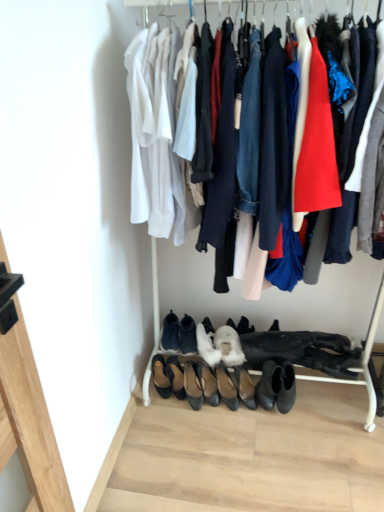
Question: From a real-world perspective, is brown leather shoe at lower left, the first footwear from the left, physically below black leather flats at center, positioned as the 5th footwear in left-to-right order?

Choices:
 (A) no
 (B) yes

Answer: (A)

Question: Is brown leather shoe at lower left, the first footwear from the left, positioned far away from black leather flats at center, positioned as the 5th footwear in left-to-right order?

Choices:
 (A) no
 (B) yes

Answer: (A)

Question: Are brown leather shoe at lower left, which ranks as the ninth footwear in right-to-left order, and black leather flats at center, the 5th footwear in the right-to-left sequence, beside each other?

Choices:
 (A) yes
 (B) no

Answer: (B)

Question: Is brown leather shoe at lower left, the first footwear from the left, wider than black leather flats at center, positioned as the 5th footwear in left-to-right order?

Choices:
 (A) no
 (B) yes

Answer: (A)

Question: Is the position of brown leather shoe at lower left, which ranks as the ninth footwear in right-to-left order, more distant than that of black leather flats at center, the 5th footwear in the right-to-left sequence?

Choices:
 (A) yes
 (B) no

Answer: (A)

Question: From the image's perspective, is white suede heels at center, acting as the sixth footwear starting from the left, above or below white fluffy boot at center, the 7th footwear positioned from the left?

Choices:
 (A) below
 (B) above

Answer: (A)

Question: In the image, is white suede heels at center, arranged as the 4th footwear when viewed from the right, positioned in front of or behind white fluffy boot at center, the third footwear when ordered from right to left?

Choices:
 (A) behind
 (B) front

Answer: (B)

Question: Based on their positions, is white suede heels at center, arranged as the 4th footwear when viewed from the right, located to the left or right of white fluffy boot at center, the 7th footwear positioned from the left?

Choices:
 (A) right
 (B) left

Answer: (B)

Question: From a real-world perspective, is white suede heels at center, arranged as the 4th footwear when viewed from the right, physically located above or below white fluffy boot at center, the 7th footwear positioned from the left?

Choices:
 (A) below
 (B) above

Answer: (A)

Question: From the image's perspective, is black leather shoes at lower center, the 9th footwear in the left-to-right sequence, positioned above or below white suede heels at center, acting as the sixth footwear starting from the left?

Choices:
 (A) below
 (B) above

Answer: (A)

Question: Is black leather shoes at lower center, the first footwear from the right, bigger or smaller than white suede heels at center, acting as the sixth footwear starting from the left?

Choices:
 (A) small
 (B) big

Answer: (A)

Question: Considering their positions, is black leather shoes at lower center, the 9th footwear in the left-to-right sequence, located in front of or behind white suede heels at center, acting as the sixth footwear starting from the left?

Choices:
 (A) behind
 (B) front

Answer: (B)

Question: From a real-world perspective, is black leather shoes at lower center, the 9th footwear in the left-to-right sequence, above or below white suede heels at center, arranged as the 4th footwear when viewed from the right?

Choices:
 (A) below
 (B) above

Answer: (A)

Question: Do you think black leather flats at center, positioned as the 5th footwear in left-to-right order, is within brown leather shoe at lower left, which ranks as the ninth footwear in right-to-left order, or outside of it?

Choices:
 (A) inside
 (B) outside

Answer: (B)

Question: From a real-world perspective, is black leather flats at center, the 5th footwear in the right-to-left sequence, above or below brown leather shoe at lower left, the first footwear from the left?

Choices:
 (A) below
 (B) above

Answer: (A)